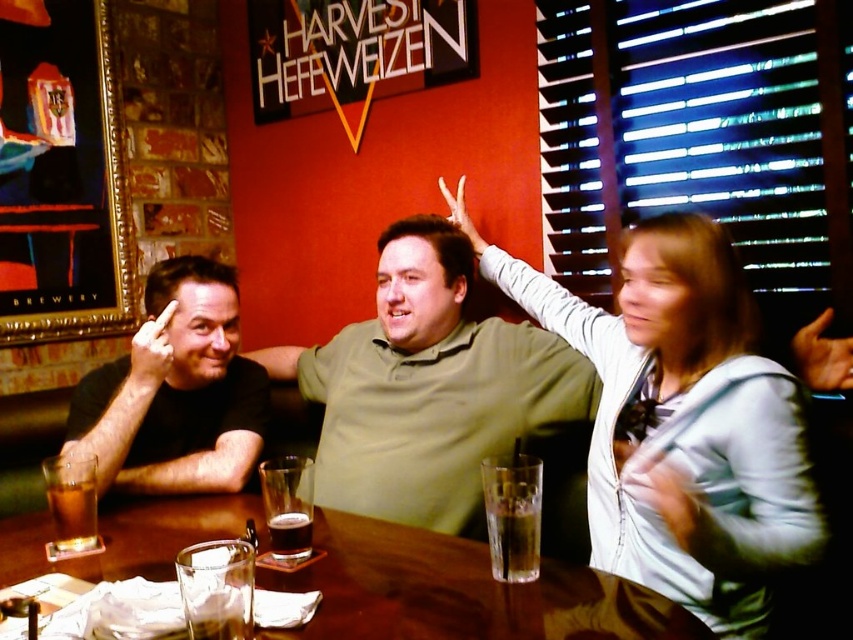
Is the position of white fabric hand at upper right more distant than that of dark brown liquid at center?

That is False.

Is white fabric hand at upper right to the left of dark brown liquid at center from the viewer's perspective?

No, white fabric hand at upper right is not to the left of dark brown liquid at center.

What do you see at coordinates (674, 502) in the screenshot?
I see `white fabric hand at upper right` at bounding box center [674, 502].

Where is `white fabric hand at upper right`? Image resolution: width=853 pixels, height=640 pixels. white fabric hand at upper right is located at coordinates click(x=674, y=502).

Between point (140, 339) and point (273, 513), which one is positioned in front?

Point (273, 513) is more forward.

Is point (135, 424) positioned after point (289, 468)?

Yes, it is behind point (289, 468).

This screenshot has height=640, width=853. What are the coordinates of `matte black arm at left` in the screenshot? It's located at (126, 401).

Between point (485, 624) and point (152, 392), which one is positioned behind?

The point (152, 392) is more distant.

Which is behind, point (115, 557) or point (165, 376)?

Point (165, 376)

Image resolution: width=853 pixels, height=640 pixels. What are the coordinates of `wooden table at center` in the screenshot? It's located at (459, 593).